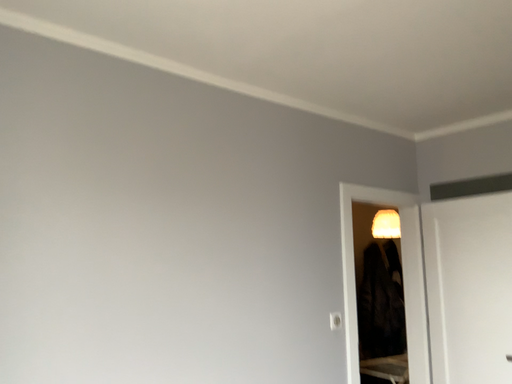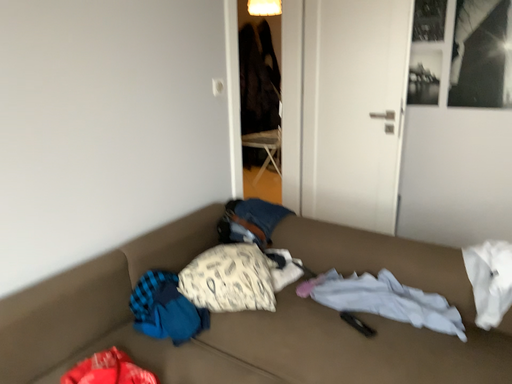
Question: Which way did the camera rotate in the video?

Choices:
 (A) rotated downward
 (B) rotated upward

Answer: (A)